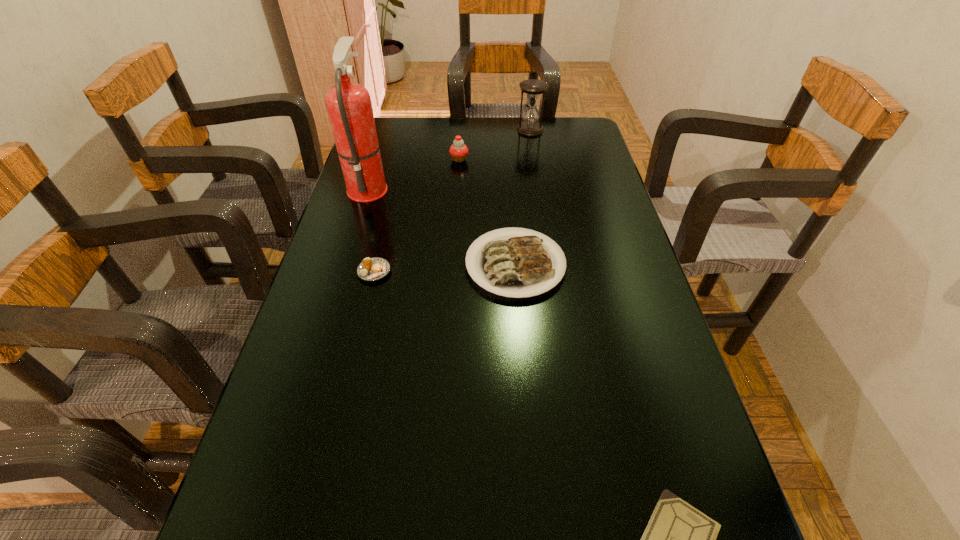
Locate an element on the screen. The image size is (960, 540). vacant point that satisfies the following two spatial constraints: 1. with the handle and hose on the plate; 2. on the right side of the third farthest object is located at coordinates (345, 265).

Identify the location of vacant position in the image that satisfies the following two spatial constraints: 1. with the handle and hose on the tallest object; 2. on the right side of the fourth tallest object. This screenshot has height=540, width=960. (345, 265).

This screenshot has width=960, height=540. I want to click on vacant region that satisfies the following two spatial constraints: 1. with the handle and hose on the fire extinguisher; 2. on the back side of the third shortest object, so click(x=345, y=265).

Locate an element on the screen. This screenshot has width=960, height=540. free space that satisfies the following two spatial constraints: 1. with the handle and hose on the third shortest object; 2. on the right side of the tallest object is located at coordinates (345, 265).